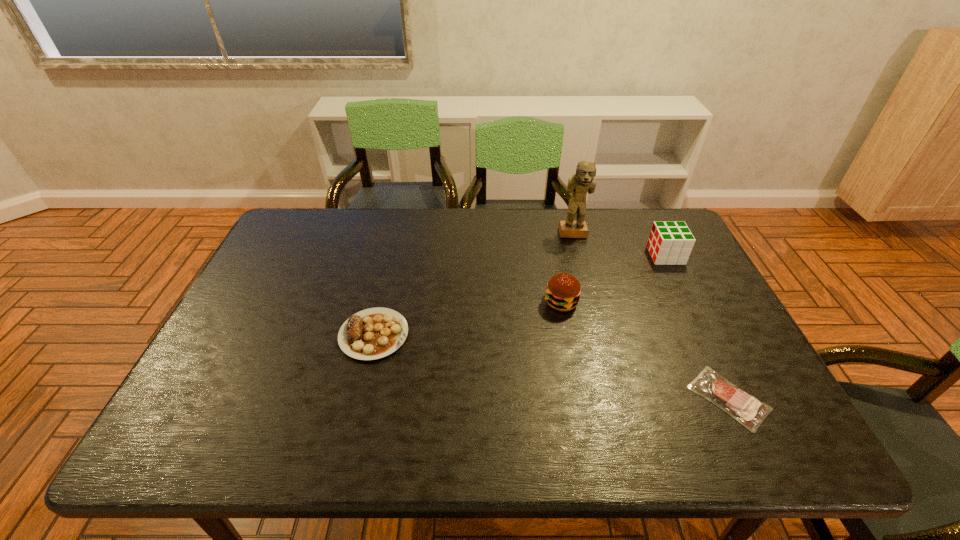
The width and height of the screenshot is (960, 540). What are the coordinates of `blank area located 0.230m on the red face of the fourth nearest object` in the screenshot? It's located at (576, 255).

Where is `vacant region located 0.090m on the red face of the fourth nearest object`? vacant region located 0.090m on the red face of the fourth nearest object is located at coordinates (621, 255).

The image size is (960, 540). Identify the location of vacant space located on the left of the hamburger. (402, 302).

Identify the location of vacant space located 0.320m on the right of the left steak. [533, 335].

The image size is (960, 540). Find the location of `vacant space located 0.100m on the left of the nearest object`. vacant space located 0.100m on the left of the nearest object is located at coordinates (647, 398).

Locate an element on the screen. Image resolution: width=960 pixels, height=540 pixels. figurine present at the far edge is located at coordinates (583, 181).

This screenshot has height=540, width=960. I want to click on cube located at the far edge, so click(670, 243).

The image size is (960, 540). I want to click on object at the near edge, so click(748, 410).

Find the location of a particular element. This screenshot has width=960, height=540. cube positioned at the right edge is located at coordinates (670, 243).

Where is `steak at the right edge`? This screenshot has width=960, height=540. steak at the right edge is located at coordinates (748, 410).